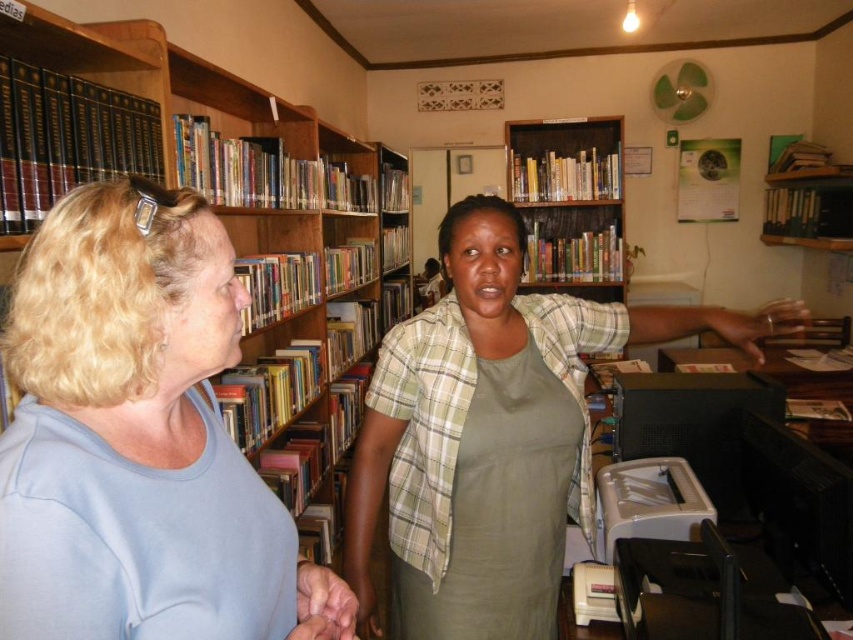
You are standing in the library and need to place a new book on the shelf. The book must be placed exactly at the coordinates mentioned in the description of the green fabric apron at center. Can you determine the exact coordinates where you should place the book?

The green fabric apron at center is located at point [486,508], so you should place the book at those coordinates.

You are standing in the library and see two points marked in the image. The first point is at coordinate point [177,320] and the second is at point [357,452]. Which point is closer to you?

Point [177,320] is in front of point [357,452], so the first point is closer to you.